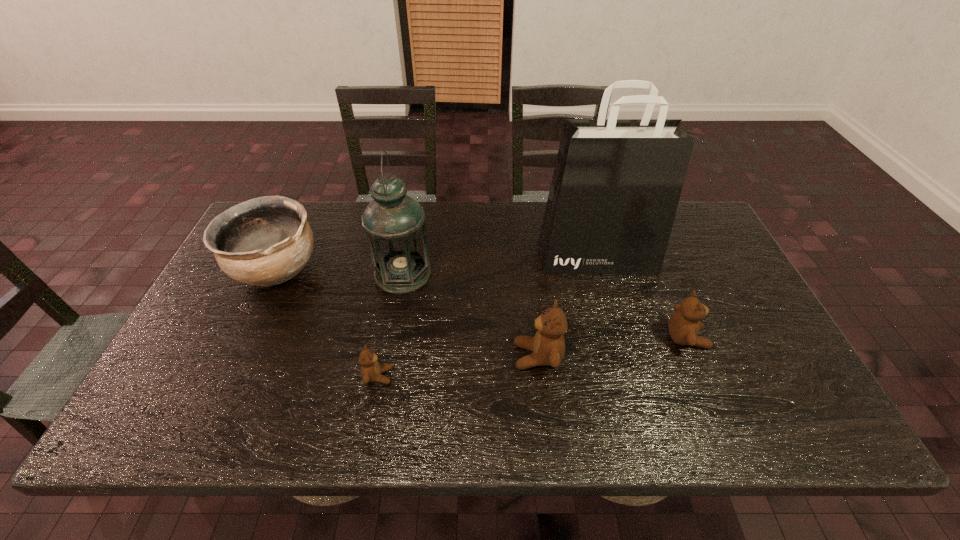
Locate an element on the screen. the shortest teddy bear is located at coordinates (371, 370).

I want to click on the shortest object, so click(x=371, y=370).

Locate an element on the screen. The image size is (960, 540). the second teddy bear from right to left is located at coordinates (547, 346).

I want to click on the second shortest object, so click(x=684, y=325).

Identify the location of the rightmost teddy bear. (684, 325).

At what (x,y) coordinates should I click in order to perform the action: click on the fifth shortest object. Please return your answer as a coordinate pair (x, y). The height and width of the screenshot is (540, 960). Looking at the image, I should click on (394, 223).

The height and width of the screenshot is (540, 960). I want to click on shopping bag, so click(x=616, y=185).

You are a GUI agent. You are given a task and a screenshot of the screen. Output one action in this format:
    pyautogui.click(x=<x>, y=<y>)
    Task: Click on the pottery
    The image size is (960, 540).
    Given the screenshot: What is the action you would take?
    pyautogui.click(x=265, y=241)

Locate an element on the screen. This screenshot has width=960, height=540. vacant position located 0.090m at the face of the leftmost teddy bear is located at coordinates (430, 376).

Image resolution: width=960 pixels, height=540 pixels. I want to click on vacant region located at the face of the second teddy bear from left to right, so click(366, 356).